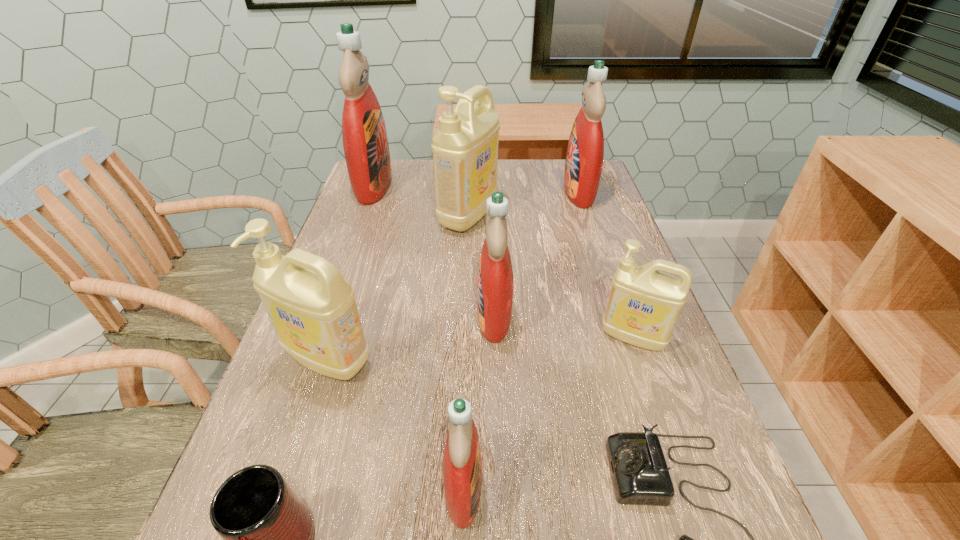
Where is `vacant region located 0.090m on the front surface of the nearest detergent`? This screenshot has width=960, height=540. vacant region located 0.090m on the front surface of the nearest detergent is located at coordinates (540, 488).

Locate an element on the screen. object at the far left corner is located at coordinates (365, 142).

Where is `object present at the far right corner`? object present at the far right corner is located at coordinates (585, 152).

Identify the location of free space at the far edge. (542, 171).

This screenshot has width=960, height=540. In the image, there is a desktop. Find the location of `vacant space at the left edge`. vacant space at the left edge is located at coordinates (398, 228).

At what (x,y) coordinates should I click in order to perform the action: click on free space at the right edge. Please return your answer as a coordinate pair (x, y). Image resolution: width=960 pixels, height=540 pixels. Looking at the image, I should click on (633, 390).

The height and width of the screenshot is (540, 960). In order to click on free spot between the smallest beige detergent and the second beige detergent from left to right in this screenshot , I will do (x=551, y=276).

The height and width of the screenshot is (540, 960). Find the location of `free space between the nearest detergent and the second smallest red detergent`. free space between the nearest detergent and the second smallest red detergent is located at coordinates (479, 402).

Where is `vacant space in between the second biggest beige detergent and the farthest beige detergent`? vacant space in between the second biggest beige detergent and the farthest beige detergent is located at coordinates (398, 287).

Locate an element on the screen. This screenshot has width=960, height=540. vacant area that lies between the rightmost beige detergent and the second nearest red detergent is located at coordinates (564, 327).